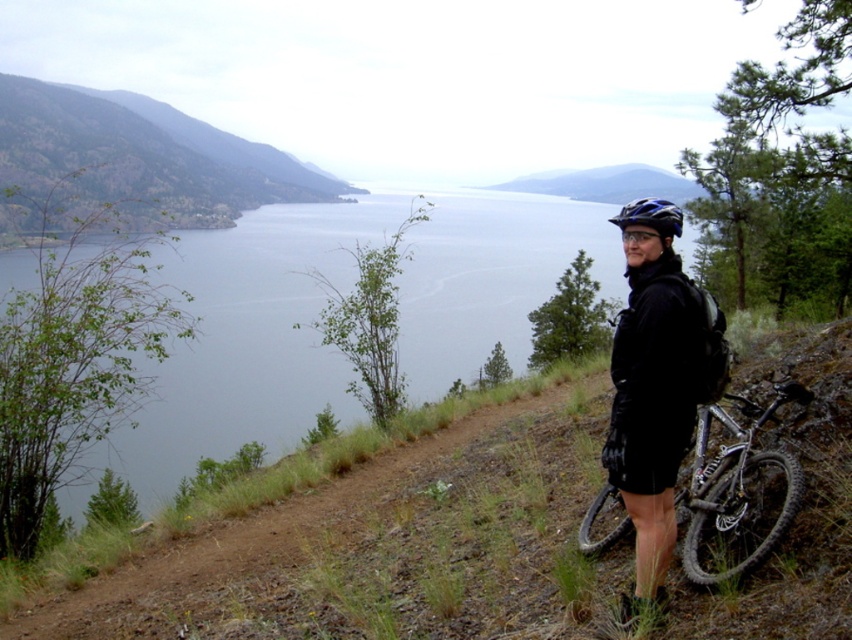
Question: Which is farther from the blue water at upper center?

Choices:
 (A) green leafy hillside at left
 (B) black matte jacket at right

Answer: (B)

Question: Observing the image, what is the correct spatial positioning of blue water at upper center in reference to black matte jacket at right?

Choices:
 (A) left
 (B) right

Answer: (A)

Question: Is the position of green leafy hillside at left less distant than that of black matte jacket at right?

Choices:
 (A) no
 (B) yes

Answer: (A)

Question: Does green leafy hillside at left have a smaller size compared to black matte jacket at right?

Choices:
 (A) yes
 (B) no

Answer: (B)

Question: Which point appears farthest from the camera in this image?

Choices:
 (A) (677, 257)
 (B) (188, 397)
 (C) (757, 497)

Answer: (B)

Question: Which object appears closest to the camera in this image?

Choices:
 (A) blue water at upper center
 (B) green leafy hillside at left

Answer: (A)